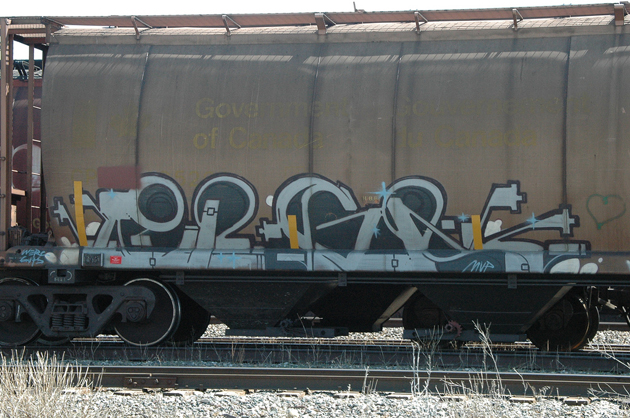
This screenshot has width=630, height=418. What are the coordinates of `metal brackets` in the screenshot? It's located at (135, 25), (225, 16), (317, 18), (415, 14), (511, 8), (616, 10).